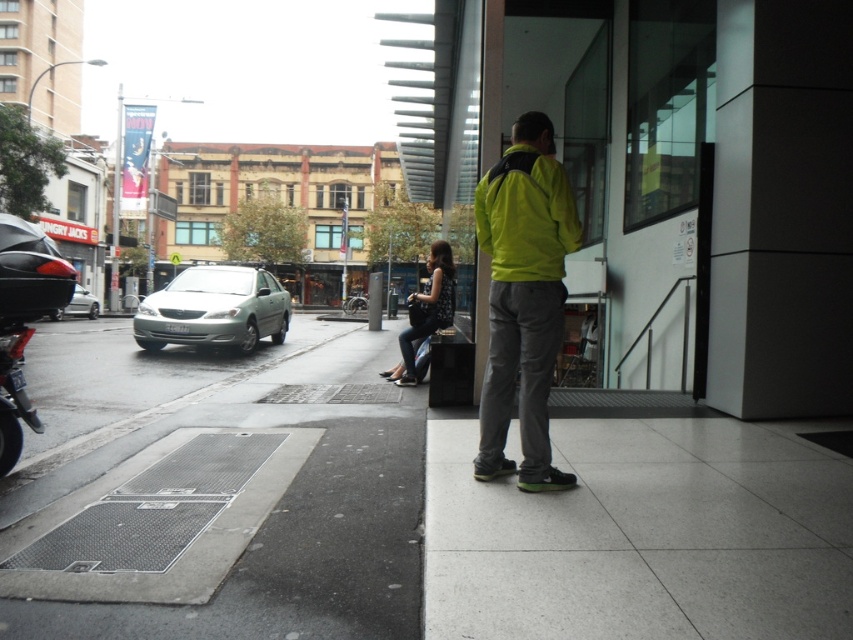
You are a delivery person needing to park your 1.2 meter wide bike between the black matte motorcycle at left and the silver metallic sedan at left. Can you fit your bike there?

The black matte motorcycle at left is thinner than the silver metallic sedan at left, so there is enough space between them to fit your 1.2 meter wide bike.

You are a delivery person needing to park your vehicle. You see the black matte motorcycle at left and the silver metallic sedan at left. Which vehicle is positioned closer to where you are standing?

The black matte motorcycle at left is closer to the viewer than the silver metallic sedan at left, so the motorcycle is positioned closer to where you are standing.